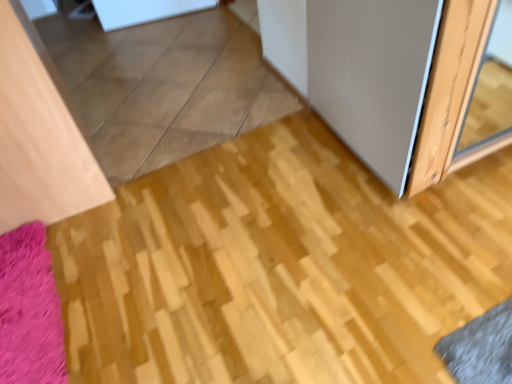
Locate an element on the screen. This screenshot has width=512, height=384. matte wood door at left is located at coordinates (39, 140).

The height and width of the screenshot is (384, 512). What do you see at coordinates (39, 140) in the screenshot?
I see `matte wood door at left` at bounding box center [39, 140].

Find the location of `matte wood door at left`. matte wood door at left is located at coordinates (39, 140).